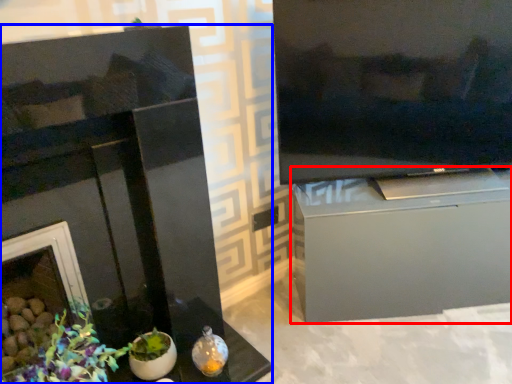
Question: Which point is further to the camera, cabinetry (highlighted by a red box) or fireplace (highlighted by a blue box)?

Choices:
 (A) cabinetry
 (B) fireplace

Answer: (A)